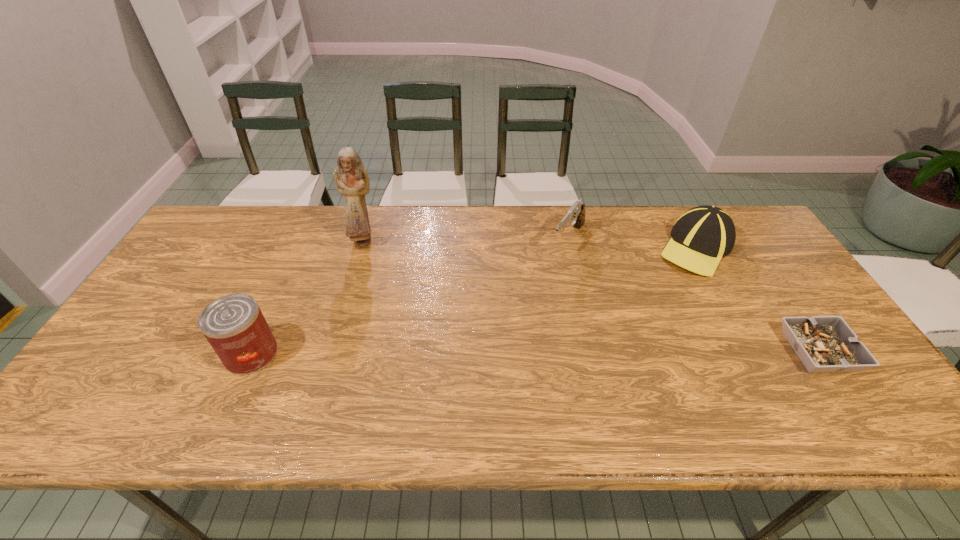
This screenshot has height=540, width=960. Find the location of `the leftmost object`. the leftmost object is located at coordinates (234, 325).

Where is `the shortest object`? The width and height of the screenshot is (960, 540). the shortest object is located at coordinates (824, 344).

Where is `gun`? gun is located at coordinates (575, 217).

Where is `the fourth object from right to left`? This screenshot has height=540, width=960. the fourth object from right to left is located at coordinates (351, 177).

The height and width of the screenshot is (540, 960). Identify the location of figurine. (351, 177).

The height and width of the screenshot is (540, 960). Find the location of `baseball cap`. baseball cap is located at coordinates (703, 235).

The height and width of the screenshot is (540, 960). Identify the location of vacant space located on the right of the can. (305, 354).

Find the location of a particular element. The width and height of the screenshot is (960, 540). vacant space located on the left of the ashtray is located at coordinates (695, 352).

This screenshot has width=960, height=540. I want to click on free region located at the muzzle of the third object from right to left, so click(x=532, y=302).

Locate an element on the screen. vacant space located 0.400m at the muzzle of the third object from right to left is located at coordinates (498, 351).